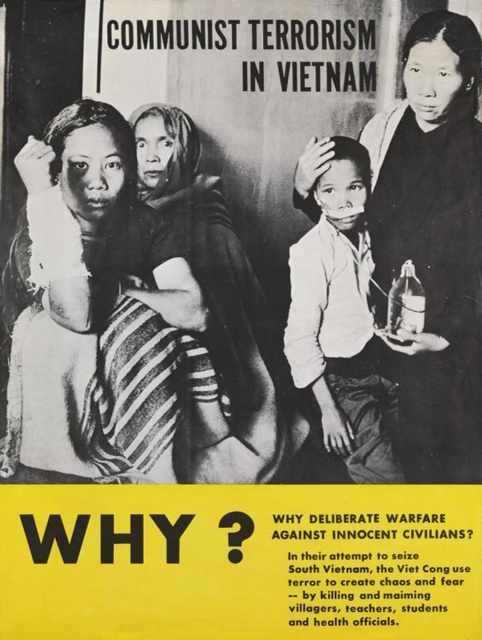
Does matte black dress at left have a greater width compared to smooth black fabric at right?

Indeed, matte black dress at left has a greater width compared to smooth black fabric at right.

Can you confirm if matte black dress at left is positioned to the left of smooth black fabric at right?

Yes, matte black dress at left is to the left of smooth black fabric at right.

Identify the location of matte black dress at left. (128, 324).

What do you see at coordinates (128, 324) in the screenshot? The height and width of the screenshot is (640, 482). I see `matte black dress at left` at bounding box center [128, 324].

Does matte black dress at left have a lesser height compared to white matte shirt at center?

Incorrect, matte black dress at left's height does not fall short of white matte shirt at center's.

Where is `matte black dress at left`? matte black dress at left is located at coordinates (128, 324).

Identify the location of matte black dress at left. (128, 324).

Can you confirm if smooth black fabric at right is positioned to the right of white matte shirt at center?

Correct, you'll find smooth black fabric at right to the right of white matte shirt at center.

Describe the element at coordinates (433, 243) in the screenshot. I see `smooth black fabric at right` at that location.

This screenshot has width=482, height=640. In order to click on smooth black fabric at right in this screenshot , I will do `click(433, 243)`.